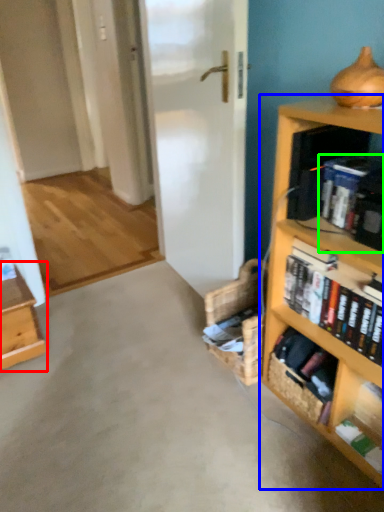
Question: Considering the real-world distances, which object is farthest from table (highlighted by a red box)? bookcase (highlighted by a blue box) or book (highlighted by a green box)?

Choices:
 (A) bookcase
 (B) book

Answer: (B)